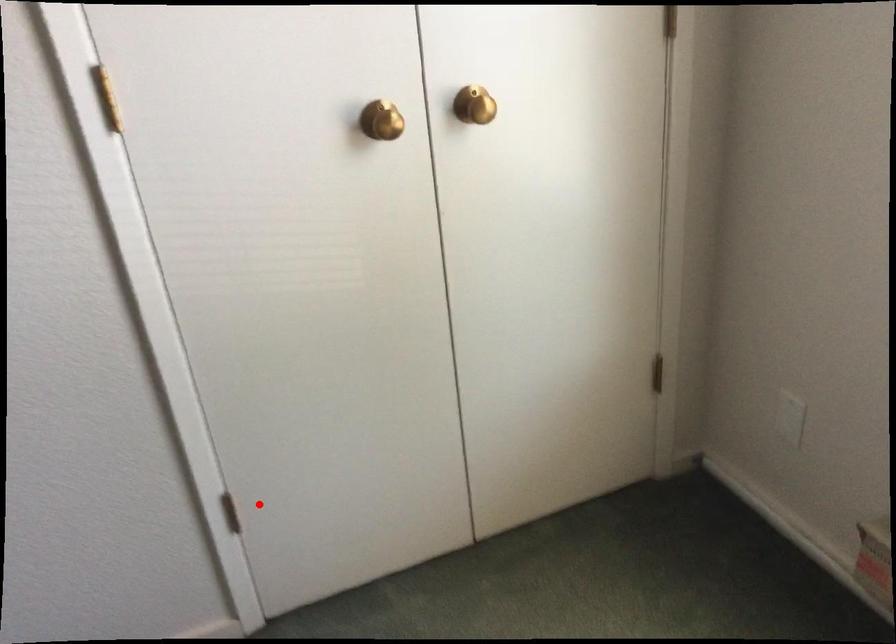
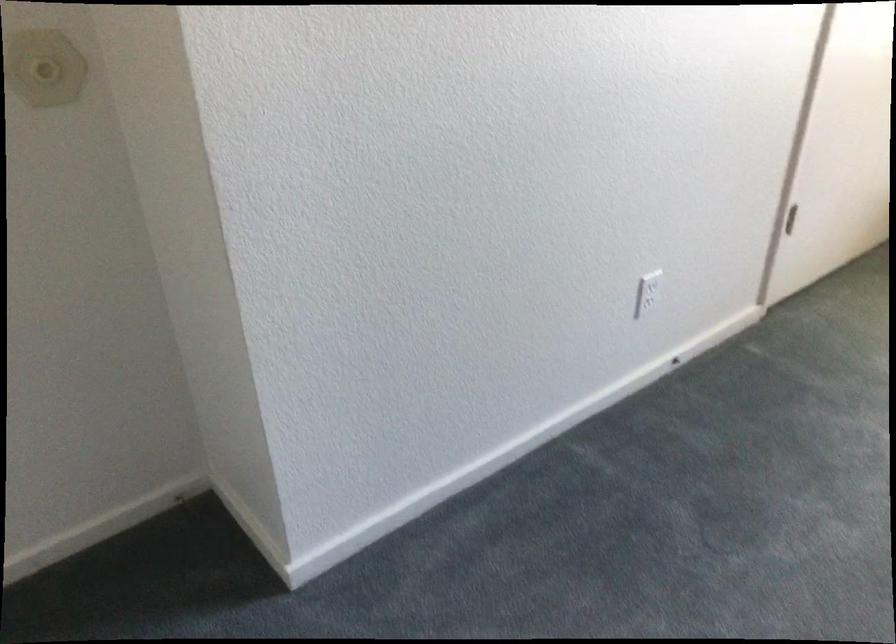
Question: I am providing you with two images of the same scene from different viewpoints. In image1, a red point is highlighted. Considering the same 3D point in image2, which of the following is correct?

Choices:
 (A) It is closer
 (B) It is farther

Answer: (B)